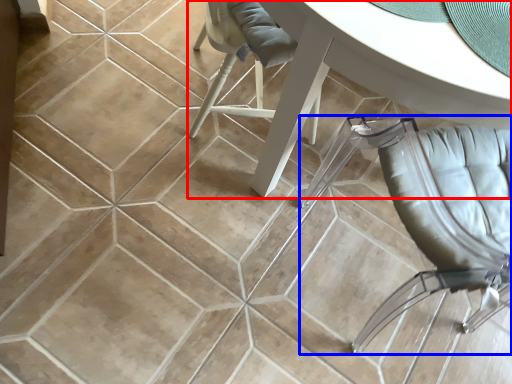
Question: Among these objects, which one is nearest to the camera, table (highlighted by a red box) or chair (highlighted by a blue box)?

Choices:
 (A) table
 (B) chair

Answer: (B)